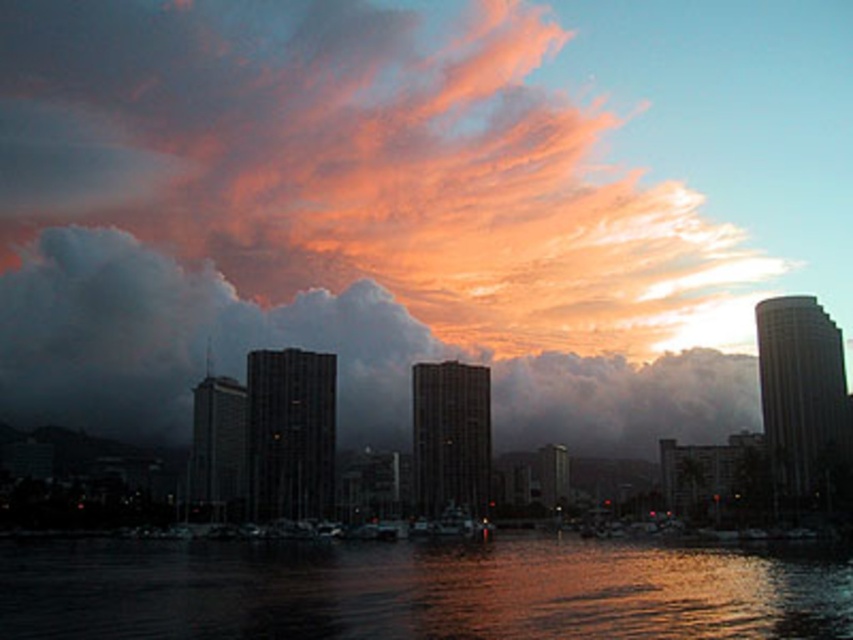
Question: Does cloudy sky at upper center appear on the left side of glistening dark water at lower center?

Choices:
 (A) no
 (B) yes

Answer: (B)

Question: In this image, where is cloudy sky at upper center located relative to glistening dark water at lower center?

Choices:
 (A) below
 (B) above

Answer: (B)

Question: Does orange cotton clouds at upper center appear on the left side of glistening dark water at lower center?

Choices:
 (A) no
 (B) yes

Answer: (B)

Question: Which point appears farthest from the camera in this image?

Choices:
 (A) (502, 19)
 (B) (285, 561)

Answer: (A)

Question: Which object is farther from the camera taking this photo?

Choices:
 (A) orange cotton clouds at upper center
 (B) glistening dark water at lower center
 (C) cloudy sky at upper center

Answer: (A)

Question: Which of these objects is positioned closest to the cloudy sky at upper center?

Choices:
 (A) orange cotton clouds at upper center
 (B) glistening dark water at lower center

Answer: (A)